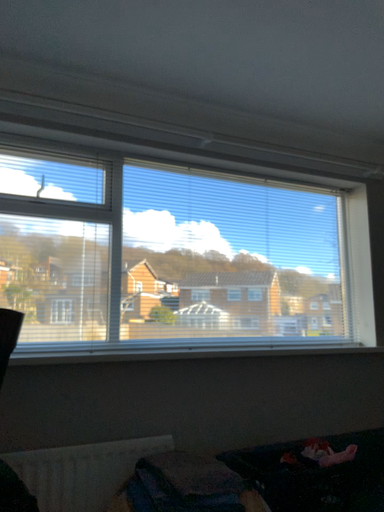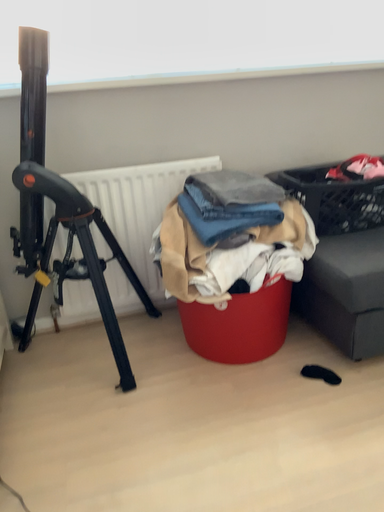
Question: Which way did the camera rotate in the video?

Choices:
 (A) rotated downward
 (B) rotated upward

Answer: (A)